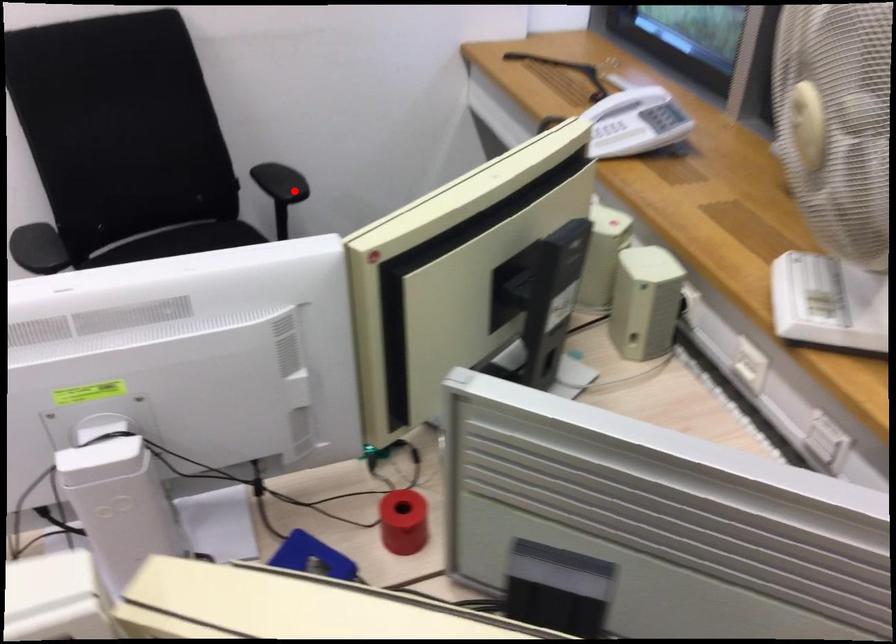
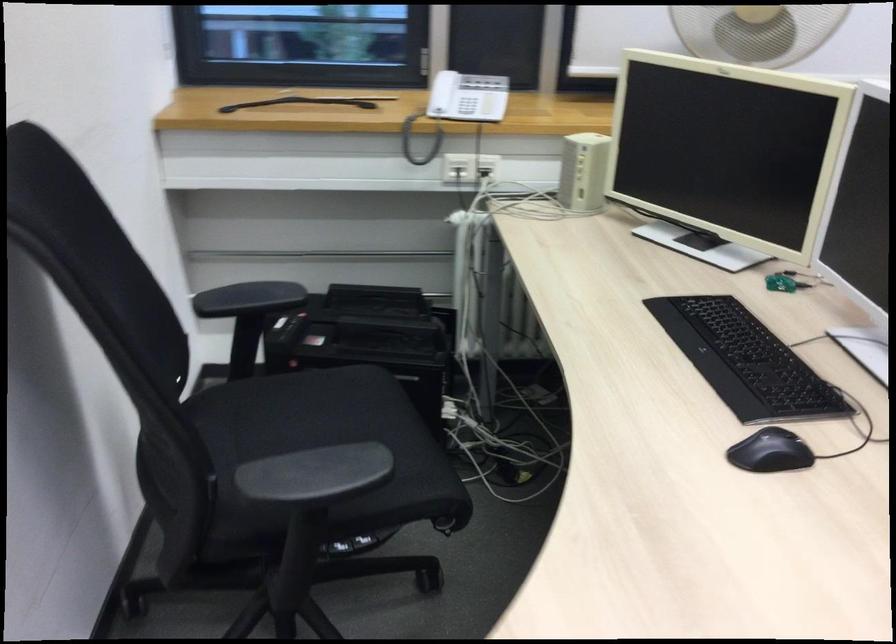
Question: I am providing you with two images of the same scene from different viewpoints. Image1 has a red point marked. In image2, the corresponding 3D location appears at what relative position? Reply with the corresponding letter.

Choices:
 (A) Closer
 (B) Farther

Answer: (A)